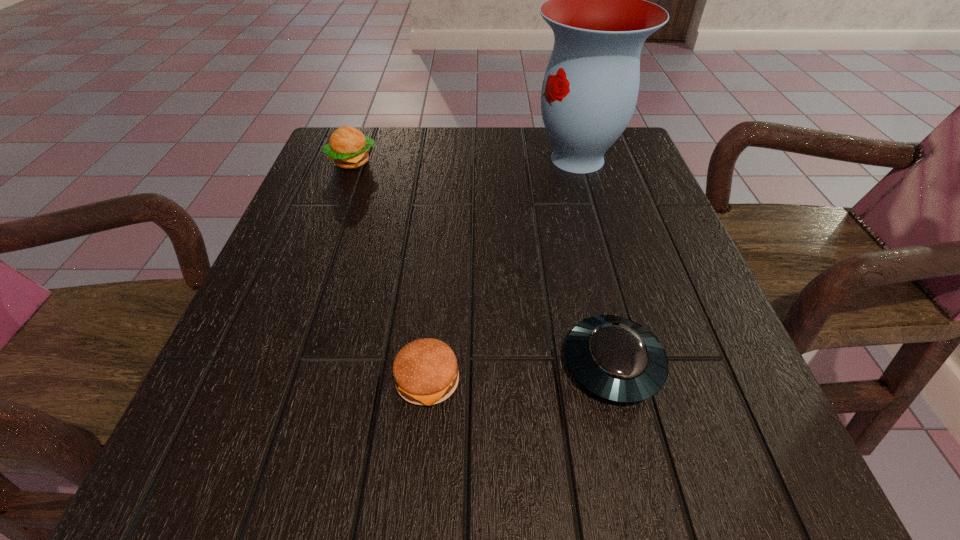
The height and width of the screenshot is (540, 960). I want to click on vase present at the far edge, so click(596, 7).

You are a GUI agent. You are given a task and a screenshot of the screen. Output one action in this format:
    pyautogui.click(x=<x>, y=<y>)
    Task: Click on the hamburger that is at the far edge
    This screenshot has height=540, width=960.
    Given the screenshot: What is the action you would take?
    pyautogui.click(x=349, y=148)

Locate an element on the screen. Image resolution: width=960 pixels, height=540 pixels. object that is at the left edge is located at coordinates pos(349,148).

Where is `vase present at the right edge`? The image size is (960, 540). vase present at the right edge is located at coordinates (596, 7).

Identify the location of saucer positioned at the right edge. (614, 358).

Locate an element on the screen. object positioned at the far left corner is located at coordinates [x=349, y=148].

Find the location of `object located in the far right corner section of the desktop`. object located in the far right corner section of the desktop is located at coordinates (596, 7).

Identify the location of free space at the far edge of the desktop. (548, 173).

Where is `free space at the near edge`? The image size is (960, 540). free space at the near edge is located at coordinates (369, 470).

You are a GUI agent. You are given a task and a screenshot of the screen. Output one action in this format:
    pyautogui.click(x=<x>, y=<y>)
    Task: Click on the vacant space at the right edge of the desktop
    
    Given the screenshot: What is the action you would take?
    (x=660, y=341)